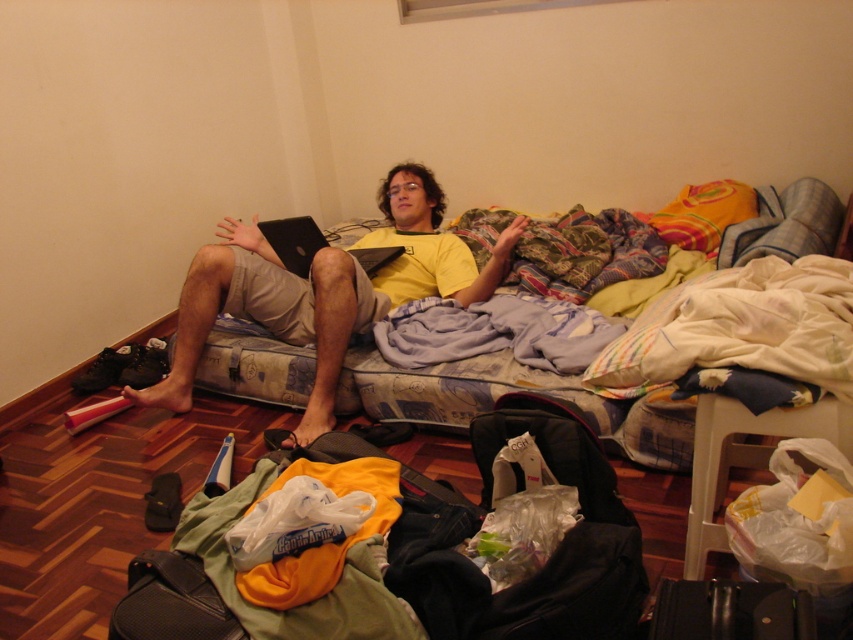
Question: Can you confirm if yellow matte/yellow t-shirt at center is thinner than black textured bag at lower left?

Choices:
 (A) no
 (B) yes

Answer: (A)

Question: Estimate the real-world distances between objects in this image. Which object is closer to the black textured bag at lower left?

Choices:
 (A) black leather suitcase at lower right
 (B) black matte laptop at center

Answer: (A)

Question: Among these points, which one is nearest to the camera?

Choices:
 (A) (282, 244)
 (B) (326, 349)
 (C) (132, 557)
 (D) (807, 609)

Answer: (D)

Question: Can you confirm if black leather suitcase at lower right is positioned to the right of black textured bag at lower left?

Choices:
 (A) no
 (B) yes

Answer: (B)

Question: Which object appears farthest from the camera in this image?

Choices:
 (A) yellow matte/yellow t-shirt at center
 (B) black matte laptop at center

Answer: (B)

Question: Where is yellow matte/yellow t-shirt at center located in relation to black textured bag at lower left in the image?

Choices:
 (A) below
 (B) above

Answer: (B)